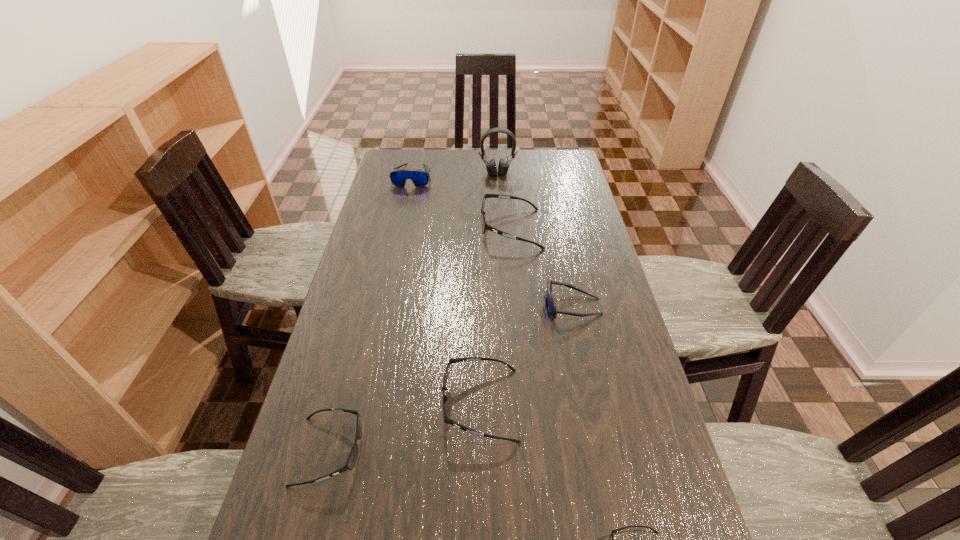
In order to click on vacant space situated 0.050m on the front-facing side of the third biggest gray sunglasses in this screenshot , I will do `click(384, 451)`.

You are a GUI agent. You are given a task and a screenshot of the screen. Output one action in this format:
    pyautogui.click(x=<x>, y=<y>)
    Task: Click on the headset present at the far edge
    
    Given the screenshot: What is the action you would take?
    pyautogui.click(x=503, y=166)

Where is `sunglasses that is at the far edge`? sunglasses that is at the far edge is located at coordinates pyautogui.click(x=420, y=178).

Locate an element on the screen. Image resolution: width=960 pixels, height=540 pixels. object present at the right edge is located at coordinates (550, 305).

Identify the location of object present at the far left corner. click(420, 178).

This screenshot has width=960, height=540. I want to click on free location at the far edge of the desktop, so click(x=440, y=171).

Where is `vacant space at the left edge of the desktop`? The image size is (960, 540). vacant space at the left edge of the desktop is located at coordinates (338, 431).

In the image, there is a desktop. Where is `vacant space at the right edge`? This screenshot has height=540, width=960. vacant space at the right edge is located at coordinates (567, 240).

Locate an element on the screen. vacant space at the far right corner of the desktop is located at coordinates (548, 150).

Locate an element on the screen. The image size is (960, 540). vacant space that's between the farthest gray sunglasses and the tallest object is located at coordinates (504, 201).